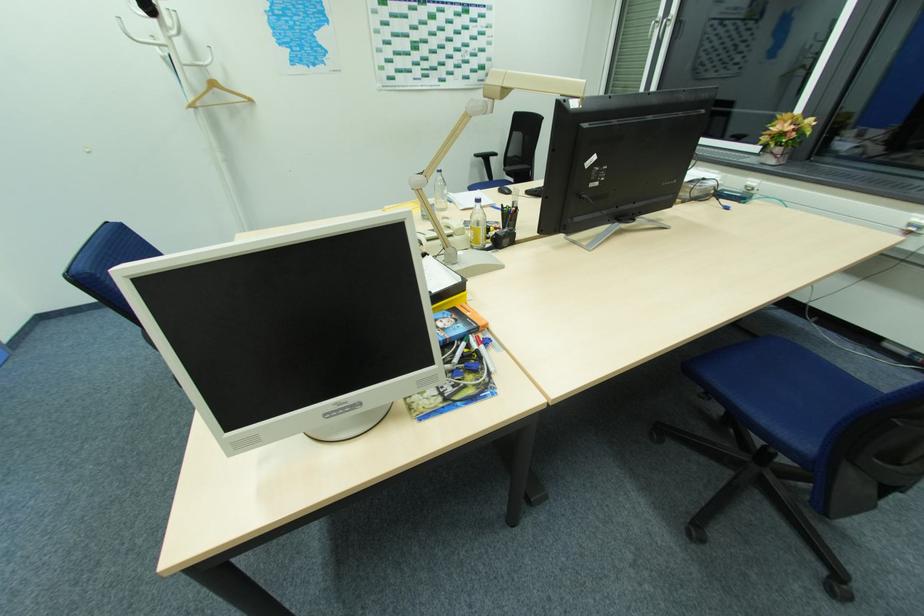
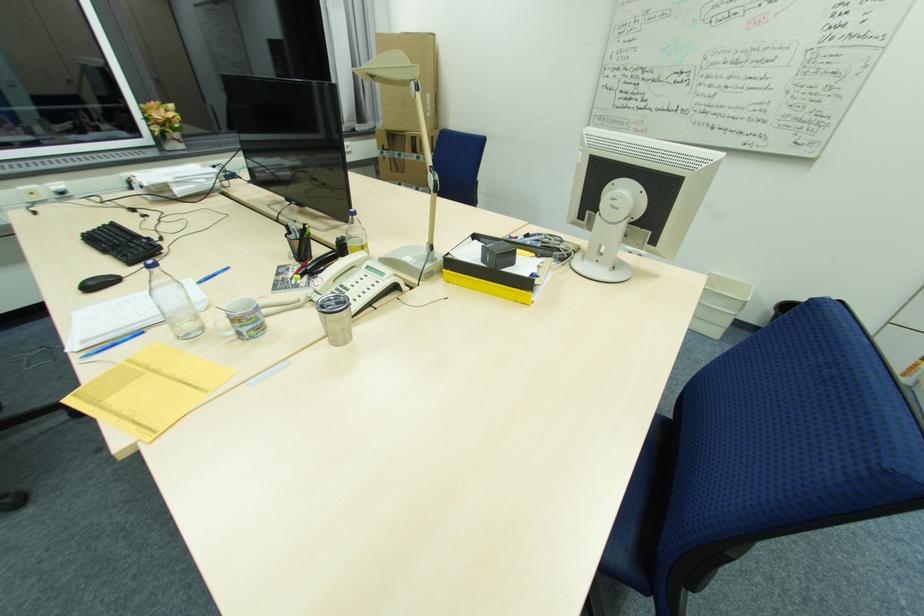
Where in the second image is the point corresponding to point 442,174 from the first image?

(157, 270)